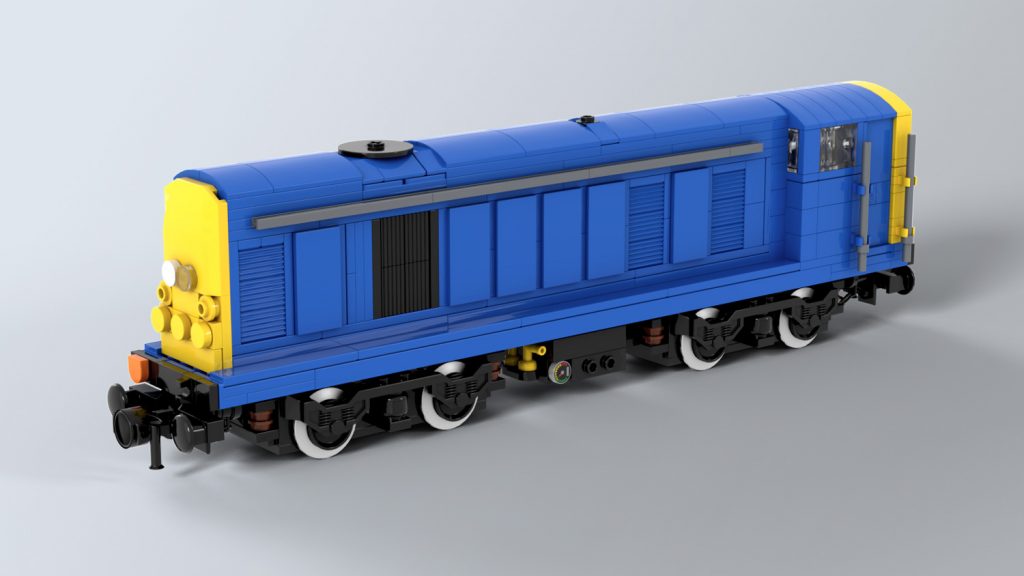
Find the location of `light gray tabletop`. light gray tabletop is located at coordinates (854, 404).